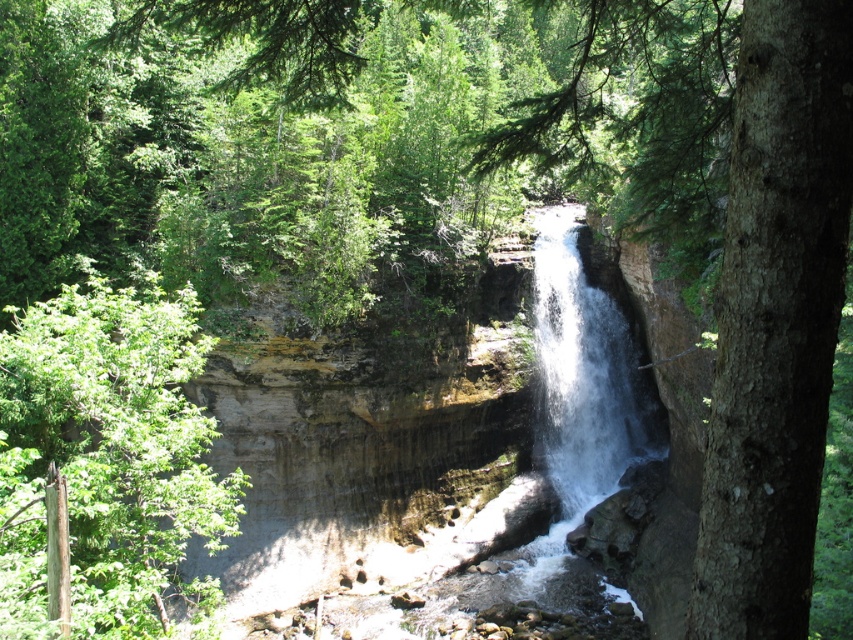
Question: Is green rough bark tree at center right wider than white frothy water at center?

Choices:
 (A) yes
 (B) no

Answer: (A)

Question: Is green rough bark tree at center right thinner than green leafy tree at center?

Choices:
 (A) no
 (B) yes

Answer: (A)

Question: Among these points, which one is farthest from the camera?

Choices:
 (A) (756, 396)
 (B) (556, 490)

Answer: (B)

Question: Which point appears closest to the camera in this image?

Choices:
 (A) (10, 628)
 (B) (827, 77)
 (C) (592, 321)

Answer: (B)

Question: Is green rough bark tree at center right above white frothy water at center?

Choices:
 (A) no
 (B) yes

Answer: (B)

Question: Which point appears farthest from the camera in this image?

Choices:
 (A) (579, 330)
 (B) (728, 45)
 (C) (48, 428)

Answer: (A)